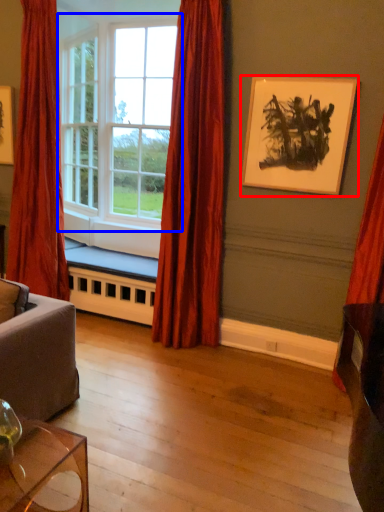
Question: Which point is closer to the camera, picture frame (highlighted by a red box) or window (highlighted by a blue box)?

Choices:
 (A) picture frame
 (B) window

Answer: (A)